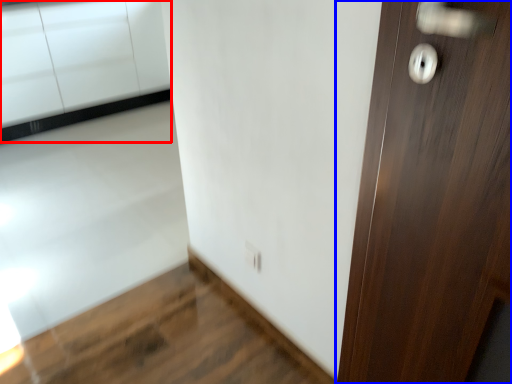
Question: Which point is closer to the camera, cabinetry (highlighted by a red box) or door (highlighted by a blue box)?

Choices:
 (A) cabinetry
 (B) door

Answer: (B)